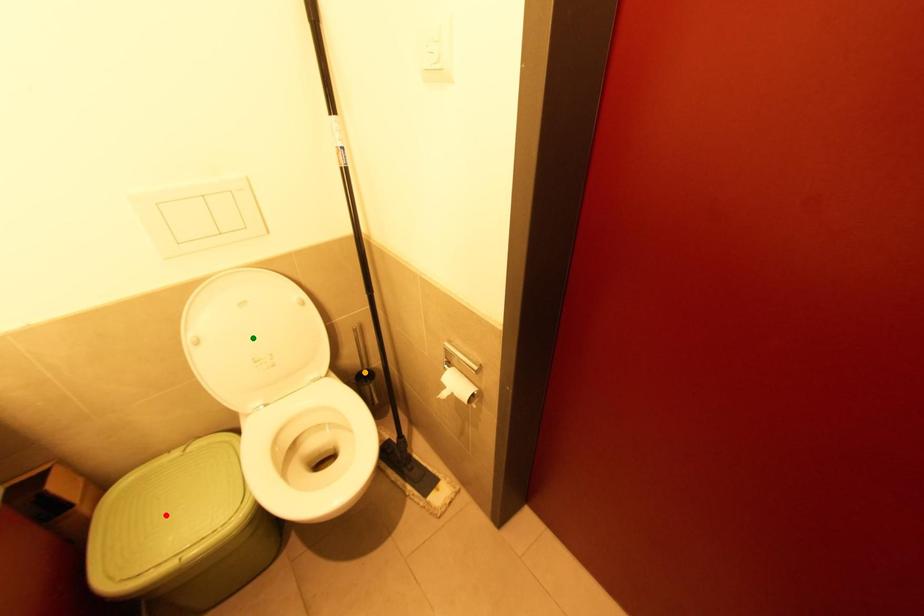
Order these from nearest to farthest:
green point | orange point | red point

red point, green point, orange point